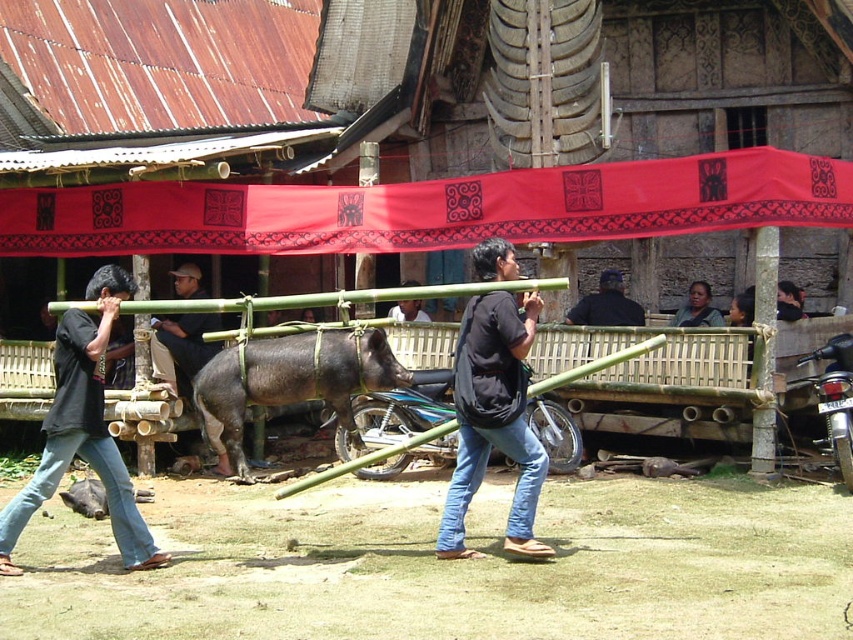
Does black shirt at center have a greater height compared to black matte pig at center?

Incorrect, black shirt at center's height is not larger of black matte pig at center's.

Does black shirt at center have a lesser width compared to black matte pig at center?

Yes.

Who is more distant from viewer, (68, 340) or (402, 284)?

The point (402, 284) is more distant.

Image resolution: width=853 pixels, height=640 pixels. In order to click on black shirt at center in this screenshot , I will do `click(83, 429)`.

Is dark brown leather cap at upper center wider than dark blue shirt at center?

In fact, dark brown leather cap at upper center might be narrower than dark blue shirt at center.

The height and width of the screenshot is (640, 853). What do you see at coordinates (181, 346) in the screenshot?
I see `dark brown leather cap at upper center` at bounding box center [181, 346].

Is point (173, 280) farther from viewer compared to point (593, 312)?

Yes.

Find the location of a particular element. The image size is (853, 640). dark brown leather cap at upper center is located at coordinates (181, 346).

Is point (61, 244) farther from viewer compared to point (74, 417)?

Yes, point (61, 244) is behind point (74, 417).

You are a GUI agent. You are given a task and a screenshot of the screen. Output one action in this format:
    pyautogui.click(x=<x>, y=<y>)
    Task: Click on the red fabric banner at upper center
    This screenshot has width=853, height=640.
    Given the screenshot: What is the action you would take?
    pyautogui.click(x=434, y=209)

Find the location of `red fabric banner at upper center`. red fabric banner at upper center is located at coordinates (434, 209).